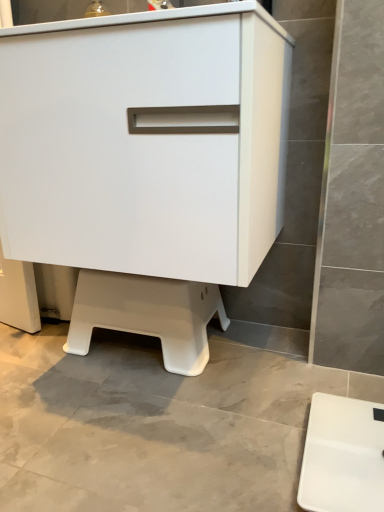
Question: From a real-world perspective, is white plastic scale at lower right physically below white plastic step stool at lower center?

Choices:
 (A) yes
 (B) no

Answer: (A)

Question: Does white plastic scale at lower right appear on the right side of white plastic step stool at lower center?

Choices:
 (A) no
 (B) yes

Answer: (B)

Question: Can you confirm if white plastic scale at lower right is shorter than white plastic step stool at lower center?

Choices:
 (A) no
 (B) yes

Answer: (B)

Question: Is white plastic scale at lower right facing towards white plastic step stool at lower center?

Choices:
 (A) no
 (B) yes

Answer: (A)

Question: Is white plastic scale at lower right behind white plastic step stool at lower center?

Choices:
 (A) no
 (B) yes

Answer: (A)

Question: From the image's perspective, is white plastic scale at lower right located above white plastic step stool at lower center?

Choices:
 (A) yes
 (B) no

Answer: (B)

Question: From the image's perspective, is white plastic step stool at lower center on top of white plastic scale at lower right?

Choices:
 (A) no
 (B) yes

Answer: (B)

Question: Is white plastic step stool at lower center not close to white plastic scale at lower right?

Choices:
 (A) no
 (B) yes

Answer: (A)

Question: Considering the relative sizes of white plastic step stool at lower center and white plastic scale at lower right in the image provided, is white plastic step stool at lower center taller than white plastic scale at lower right?

Choices:
 (A) no
 (B) yes

Answer: (B)

Question: Is white plastic step stool at lower center outside of white plastic scale at lower right?

Choices:
 (A) no
 (B) yes

Answer: (B)

Question: Considering the relative sizes of white plastic step stool at lower center and white plastic scale at lower right in the image provided, is white plastic step stool at lower center wider than white plastic scale at lower right?

Choices:
 (A) yes
 (B) no

Answer: (B)

Question: Is white plastic step stool at lower center closer to camera compared to white plastic scale at lower right?

Choices:
 (A) no
 (B) yes

Answer: (A)

Question: Can you confirm if white matte cabinet at center is shorter than white plastic step stool at lower center?

Choices:
 (A) yes
 (B) no

Answer: (B)